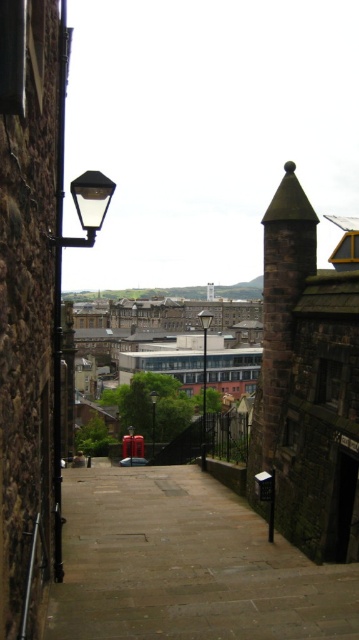
Does brown stone pavement at center appear under matte black streetlamp at upper left?

Yes.

Does brown stone pavement at center appear on the left side of matte black streetlamp at upper left?

In fact, brown stone pavement at center is to the right of matte black streetlamp at upper left.

Measure the distance between brown stone pavement at center and camera.

They are 17.59 meters apart.

Find the location of a particular element. The image size is (359, 640). brown stone pavement at center is located at coordinates (185, 564).